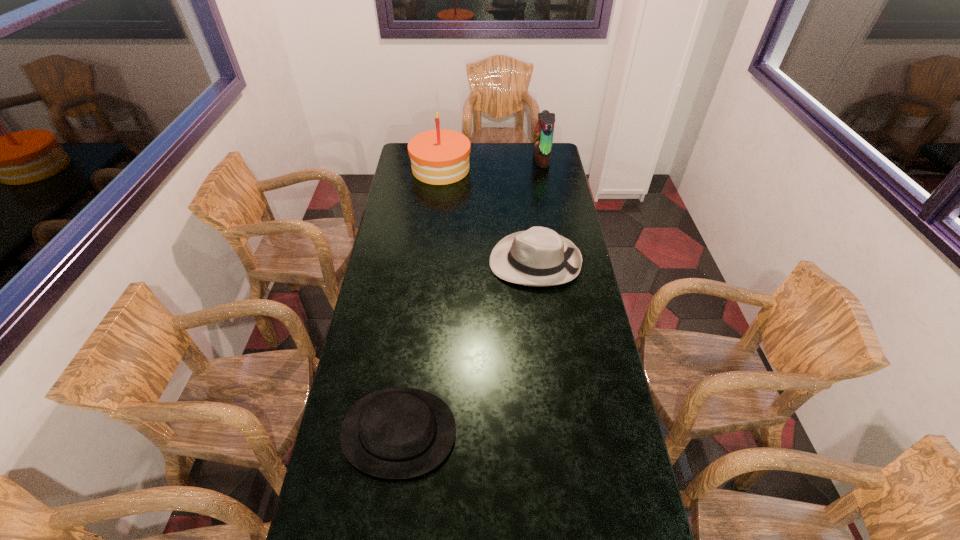
Locate an element on the screen. This screenshot has width=960, height=540. the tallest object is located at coordinates (438, 157).

Identify the location of parrot. The height and width of the screenshot is (540, 960). (544, 130).

Image resolution: width=960 pixels, height=540 pixels. What are the coordinates of `the third tallest object` in the screenshot? It's located at (539, 256).

The height and width of the screenshot is (540, 960). I want to click on the second nearest object, so click(539, 256).

This screenshot has width=960, height=540. I want to click on the left fedora, so click(395, 433).

You are a GUI agent. You are given a task and a screenshot of the screen. Output one action in this format:
    pyautogui.click(x=<x>, y=<y>)
    Task: Click on the shortest object
    
    Given the screenshot: What is the action you would take?
    pyautogui.click(x=395, y=433)

Find the location of a particular element. free space located on the right of the tallest object is located at coordinates (539, 169).

The height and width of the screenshot is (540, 960). I want to click on vacant area situated 0.210m at the face of the parrot, so click(493, 159).

At what (x,y) coordinates should I click in order to perform the action: click on free space located at the face of the parrot. Please return your answer as a coordinate pair (x, y). The image size is (960, 540). Looking at the image, I should click on (497, 159).

Where is `blank space located 0.320m at the face of the parrot`? The height and width of the screenshot is (540, 960). blank space located 0.320m at the face of the parrot is located at coordinates (473, 159).